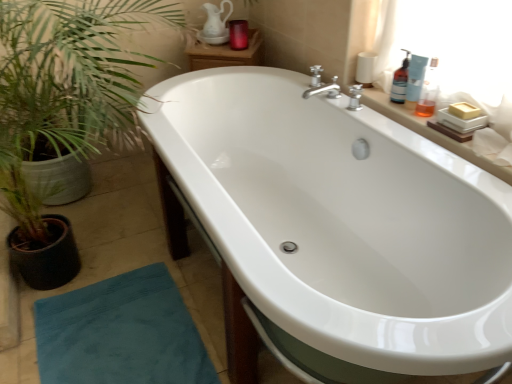
Question: From the image's perspective, is blue plastic bottle at upper right, which is counted as the 1th toiletry, starting from the front, located beneath white glossy bathtub at center?

Choices:
 (A) no
 (B) yes

Answer: (A)

Question: Is blue plastic bottle at upper right, arranged as the first toiletry when viewed from the right, wider than white glossy bathtub at center?

Choices:
 (A) yes
 (B) no

Answer: (B)

Question: Can you confirm if blue plastic bottle at upper right, which is counted as the 1th toiletry, starting from the front, is taller than white glossy bathtub at center?

Choices:
 (A) yes
 (B) no

Answer: (B)

Question: Is blue plastic bottle at upper right, arranged as the first toiletry when viewed from the right, to the left of white glossy bathtub at center from the viewer's perspective?

Choices:
 (A) yes
 (B) no

Answer: (B)

Question: Is blue plastic bottle at upper right, which is counted as the 1th toiletry, starting from the front, with white glossy bathtub at center?

Choices:
 (A) no
 (B) yes

Answer: (A)

Question: Would you say blue plastic bottle at upper right, which is counted as the 1th toiletry, starting from the front, contains white glossy bathtub at center?

Choices:
 (A) no
 (B) yes

Answer: (A)

Question: From the image's perspective, is white ceramic soap at upper right beneath translucent plastic bottle at upper right, which appears as the third toiletry when viewed from the right?

Choices:
 (A) yes
 (B) no

Answer: (A)

Question: Is white ceramic soap at upper right shorter than translucent plastic bottle at upper right, which is the second toiletry in left-to-right order?

Choices:
 (A) yes
 (B) no

Answer: (A)

Question: Considering the relative sizes of white ceramic soap at upper right and translucent plastic bottle at upper right, which appears as the third toiletry when viewed from the right, in the image provided, is white ceramic soap at upper right taller than translucent plastic bottle at upper right, which appears as the third toiletry when viewed from the right,?

Choices:
 (A) no
 (B) yes

Answer: (A)

Question: Would you say translucent plastic bottle at upper right, which appears as the third toiletry when viewed from the right, is part of white ceramic soap at upper right's contents?

Choices:
 (A) yes
 (B) no

Answer: (B)

Question: Is white ceramic soap at upper right positioned with its back to translucent plastic bottle at upper right, the third toiletry from the front?

Choices:
 (A) no
 (B) yes

Answer: (A)

Question: Is white ceramic soap at upper right positioned in front of translucent plastic bottle at upper right, which appears as the second toiletry when viewed from the back?

Choices:
 (A) yes
 (B) no

Answer: (A)

Question: From a real-world perspective, is translucent plastic bottle at upper right, which is counted as the 2th toiletry, starting from the right, under blue plastic bottle at upper right, arranged as the fourth toiletry when viewed from the left?

Choices:
 (A) yes
 (B) no

Answer: (A)